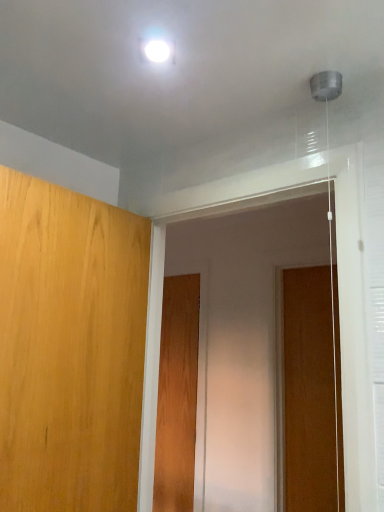
Measure the distance between point (x=108, y=237) and camera.

Point (x=108, y=237) and camera are 4.25 feet apart from each other.

Measure the distance between wooden door at center, which is the first door in back-to-front order, and camera.

The depth of wooden door at center, which is the first door in back-to-front order, is 2.43 meters.

Identify the location of light brown wood door at left, the first door positioned from the left. tap(70, 348).

Where is `the 1st door in front of the wooden door at center, placed as the 2th door when sorted from right to left`? The height and width of the screenshot is (512, 384). the 1st door in front of the wooden door at center, placed as the 2th door when sorted from right to left is located at coordinates (312, 392).

Considering the relative sizes of wooden door at center, positioned as the 3th door in front-to-back order, and wooden door at right, the second door in the front-to-back sequence, in the image provided, is wooden door at center, positioned as the 3th door in front-to-back order, thinner than wooden door at right, the second door in the front-to-back sequence,?

Incorrect, the width of wooden door at center, positioned as the 3th door in front-to-back order, is not less than that of wooden door at right, the second door in the front-to-back sequence.

Would you consider wooden door at center, which is the 2th door in left-to-right order, to be distant from wooden door at right, which appears as the third door when viewed from the left?

They are positioned close to each other.

Looking at this image, is wooden door at right, which appears as the third door when viewed from the left, at the back of wooden door at center, which is the 2th door in left-to-right order?

wooden door at center, which is the 2th door in left-to-right order, is not turned away from wooden door at right, which appears as the third door when viewed from the left.

Is the surface of transparent plastic screen door at center in direct contact with wooden door at center, placed as the 2th door when sorted from right to left?

No, transparent plastic screen door at center is not next to wooden door at center, placed as the 2th door when sorted from right to left.

From a real-world perspective, is transparent plastic screen door at center below wooden door at center, positioned as the 3th door in front-to-back order?

No, from a real-world perspective, transparent plastic screen door at center is not below wooden door at center, positioned as the 3th door in front-to-back order.

Is transparent plastic screen door at center facing towards wooden door at center, placed as the 2th door when sorted from right to left?

No, transparent plastic screen door at center is not oriented towards wooden door at center, placed as the 2th door when sorted from right to left.

Which object is further away from the camera, transparent plastic screen door at center or wooden door at center, placed as the 2th door when sorted from right to left?

Positioned behind is wooden door at center, placed as the 2th door when sorted from right to left.

I want to click on screen door above the light brown wood door at left, the 3th door positioned from the right (from a real-world perspective), so click(x=243, y=335).

Is transparent plastic screen door at center completely or partially outside of light brown wood door at left, the 3th door positioned from the right?

Yes, transparent plastic screen door at center is outside of light brown wood door at left, the 3th door positioned from the right.

In the image, is transparent plastic screen door at center positioned in front of or behind light brown wood door at left, the 3th door viewed from the back?

Clearly, transparent plastic screen door at center is behind light brown wood door at left, the 3th door viewed from the back.

How much distance is there between transparent plastic screen door at center and light brown wood door at left, the 3th door viewed from the back?

They are 3.99 feet apart.

Choose the correct answer: Is wooden door at right, which appears as the third door when viewed from the left, inside transparent plastic screen door at center or outside it?

wooden door at right, which appears as the third door when viewed from the left, is spatially situated outside transparent plastic screen door at center.

How different are the orientations of wooden door at right, the 1th door from the right, and transparent plastic screen door at center in degrees?

0.481 degrees separate the facing orientations of wooden door at right, the 1th door from the right, and transparent plastic screen door at center.

Considering the relative sizes of wooden door at right, acting as the 2th door starting from the back, and transparent plastic screen door at center in the image provided, is wooden door at right, acting as the 2th door starting from the back, smaller than transparent plastic screen door at center?

Indeed, wooden door at right, acting as the 2th door starting from the back, has a smaller size compared to transparent plastic screen door at center.

From the image's perspective, between wooden door at right, which appears as the third door when viewed from the left, and transparent plastic screen door at center, who is located below?

wooden door at right, which appears as the third door when viewed from the left, from the image's perspective.

Are light brown wood door at left, the 3th door viewed from the back, and transparent plastic screen door at center located far from each other?

Indeed, light brown wood door at left, the 3th door viewed from the back, is not near transparent plastic screen door at center.

Is light brown wood door at left, the 3th door viewed from the back, facing away from transparent plastic screen door at center?

No.

What's the angular difference between light brown wood door at left, the first door positioned from the left, and transparent plastic screen door at center's facing directions?

light brown wood door at left, the first door positioned from the left, and transparent plastic screen door at center are facing 97.6 degrees away from each other.

Is wooden door at center, which is the 2th door in left-to-right order, completely or partially inside wooden door at right, acting as the 2th door starting from the back?

No, wooden door at center, which is the 2th door in left-to-right order, is not inside wooden door at right, acting as the 2th door starting from the back.

How different are the orientations of wooden door at right, acting as the 2th door starting from the back, and wooden door at center, placed as the 2th door when sorted from right to left, in degrees?

There is a 0.00243-degree angle between the facing directions of wooden door at right, acting as the 2th door starting from the back, and wooden door at center, placed as the 2th door when sorted from right to left.

From a real-world perspective, is wooden door at right, which appears as the third door when viewed from the left, under wooden door at center, positioned as the 3th door in front-to-back order?

No, from a real-world perspective, wooden door at right, which appears as the third door when viewed from the left, is not below wooden door at center, positioned as the 3th door in front-to-back order.

From the image's perspective, which one is positioned higher, wooden door at right, which appears as the third door when viewed from the left, or wooden door at center, placed as the 2th door when sorted from right to left?

wooden door at right, which appears as the third door when viewed from the left, appears higher in the image.

Is transparent plastic screen door at center oriented towards wooden door at right, the second door in the front-to-back sequence?

No, transparent plastic screen door at center is not turned towards wooden door at right, the second door in the front-to-back sequence.

Can we say transparent plastic screen door at center lies outside wooden door at right, which appears as the third door when viewed from the left?

Yes, transparent plastic screen door at center is located beyond the bounds of wooden door at right, which appears as the third door when viewed from the left.

Are transparent plastic screen door at center and wooden door at right, acting as the 2th door starting from the back, far apart?

transparent plastic screen door at center is actually quite close to wooden door at right, acting as the 2th door starting from the back.

At what (x,y) coordinates should I click in order to perform the action: click on door lying below the wooden door at right, the second door in the front-to-back sequence (from the image's perspective). Please return your answer as a coordinate pair (x, y). Looking at the image, I should click on (177, 395).

The width and height of the screenshot is (384, 512). In order to click on screen door above the wooden door at center, which is the first door in back-to-front order (from the image's perspective) in this screenshot , I will do `click(243, 335)`.

Which object lies further to the anchor point wooden door at center, which is the 2th door in left-to-right order, light brown wood door at left, the first door positioned from the left, or transparent plastic screen door at center?

light brown wood door at left, the first door positioned from the left.

Looking at the image, which one is located closer to light brown wood door at left, the first door positioned from the left, wooden door at right, the 1th door from the right, or transparent plastic screen door at center?

Among the two, transparent plastic screen door at center is located nearer to light brown wood door at left, the first door positioned from the left.

From the picture: Looking at the image, which one is located closer to light brown wood door at left, marked as the first door in a front-to-back arrangement, wooden door at center, which is the 2th door in left-to-right order, or wooden door at right, the second door in the front-to-back sequence?

wooden door at right, the second door in the front-to-back sequence, lies closer to light brown wood door at left, marked as the first door in a front-to-back arrangement, than the other object.

Considering their positions, is light brown wood door at left, the 3th door positioned from the right, positioned closer to wooden door at center, which is the 2th door in left-to-right order, than wooden door at right, the second door in the front-to-back sequence?

wooden door at right, the second door in the front-to-back sequence, lies closer to wooden door at center, which is the 2th door in left-to-right order, than the other object.

From the image, which object appears to be farther from wooden door at right, the 1th door from the right, light brown wood door at left, the first door positioned from the left, or wooden door at center, which is the 2th door in left-to-right order?

light brown wood door at left, the first door positioned from the left.

Considering their positions, is transparent plastic screen door at center positioned further to wooden door at right, acting as the 2th door starting from the back, than wooden door at center, which is the 2th door in left-to-right order?

Based on the image, wooden door at center, which is the 2th door in left-to-right order, appears to be further to wooden door at right, acting as the 2th door starting from the back.

Estimate the real-world distances between objects in this image. Which object is further from light brown wood door at left, the 3th door viewed from the back, transparent plastic screen door at center or wooden door at right, which appears as the third door when viewed from the left?

wooden door at right, which appears as the third door when viewed from the left, lies further to light brown wood door at left, the 3th door viewed from the back, than the other object.

Estimate the real-world distances between objects in this image. Which object is closer to wooden door at right, the 1th door from the right, wooden door at center, positioned as the 3th door in front-to-back order, or light brown wood door at left, marked as the first door in a front-to-back arrangement?

Based on the image, wooden door at center, positioned as the 3th door in front-to-back order, appears to be nearer to wooden door at right, the 1th door from the right.

Locate an element on the screen. door positioned between light brown wood door at left, marked as the first door in a front-to-back arrangement, and wooden door at center, placed as the 2th door when sorted from right to left, from near to far is located at coordinates (312, 392).

Locate an element on the screen. door positioned between transparent plastic screen door at center and wooden door at center, positioned as the 3th door in front-to-back order, from near to far is located at coordinates (312, 392).

At what (x,y) coordinates should I click in order to perform the action: click on screen door between light brown wood door at left, the 3th door viewed from the back, and wooden door at right, which appears as the third door when viewed from the left, from front to back. Please return your answer as a coordinate pair (x, y). The height and width of the screenshot is (512, 384). Looking at the image, I should click on (243, 335).

At what (x,y) coordinates should I click in order to perform the action: click on screen door between light brown wood door at left, the first door positioned from the left, and wooden door at center, which is the first door in back-to-front order, along the z-axis. Please return your answer as a coordinate pair (x, y). Looking at the image, I should click on coord(243,335).